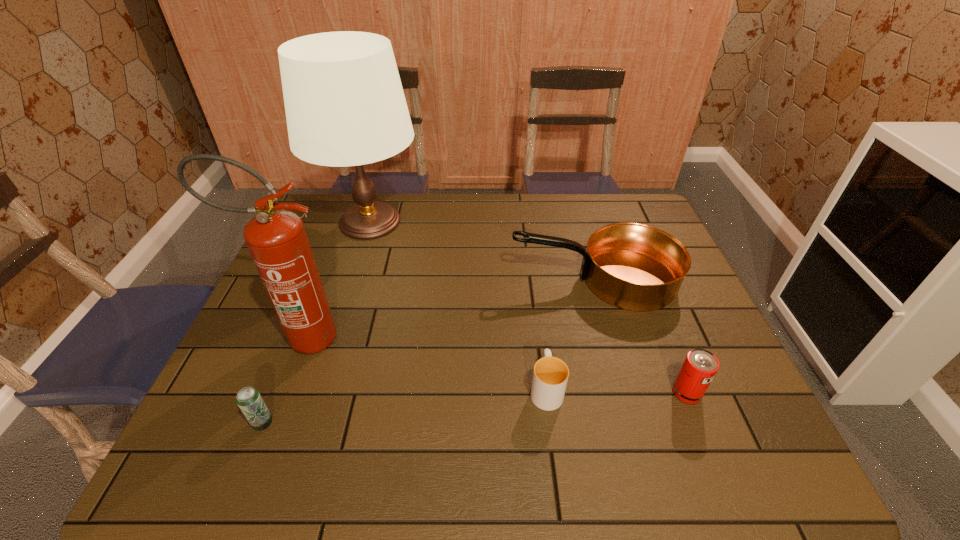
This screenshot has width=960, height=540. In order to click on frying pan present at the right edge in this screenshot , I will do `click(632, 266)`.

Identify the location of can present at the right edge. This screenshot has height=540, width=960. (700, 366).

What are the coordinates of `object that is at the far left corner` in the screenshot? It's located at (345, 106).

This screenshot has width=960, height=540. Identify the location of vacant space at the far edge of the desktop. click(556, 221).

Locate an element on the screen. The width and height of the screenshot is (960, 540). vacant space at the near edge of the desktop is located at coordinates (691, 476).

At what (x,y) coordinates should I click in order to perform the action: click on blank space at the left edge of the desktop. Please return your answer as a coordinate pair (x, y). Looking at the image, I should click on (215, 405).

Find the location of `free space at the right edge of the desktop`. free space at the right edge of the desktop is located at coordinates (727, 355).

This screenshot has width=960, height=540. I want to click on vacant area at the far left corner of the desktop, so click(339, 224).

You are a GUI agent. You are given a task and a screenshot of the screen. Output one action in this format:
    pyautogui.click(x=<x>, y=<y>)
    Task: Click on the free location at the far right corner
    This screenshot has height=540, width=960.
    Given the screenshot: What is the action you would take?
    pyautogui.click(x=630, y=216)

In the image, there is a desktop. Identify the location of vacant space at the near right corner. The height and width of the screenshot is (540, 960). (752, 456).